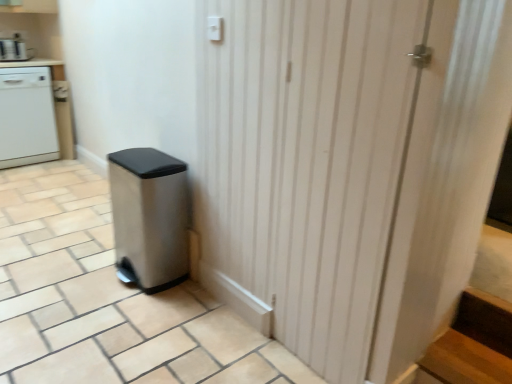
In order to click on empty space that is in between stainless steel trash can at lower left and white wood screen door at center in this screenshot , I will do `click(219, 328)`.